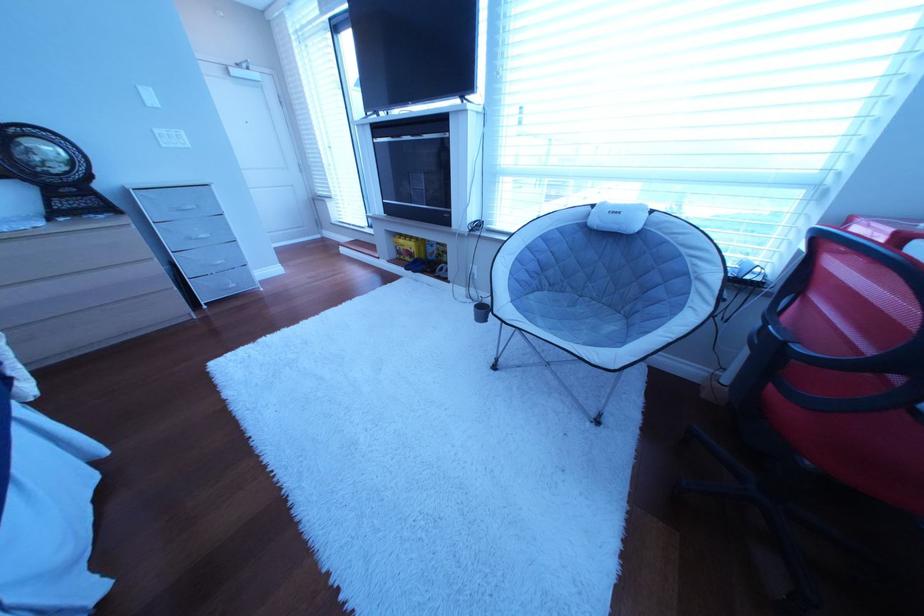
Find the location of a particular element. grey chair sitting surface is located at coordinates (574, 318).